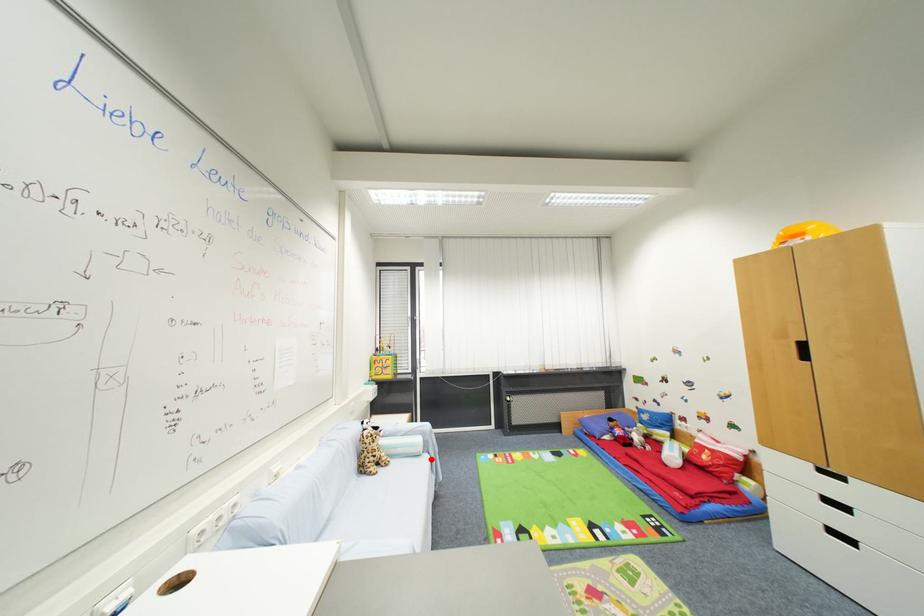
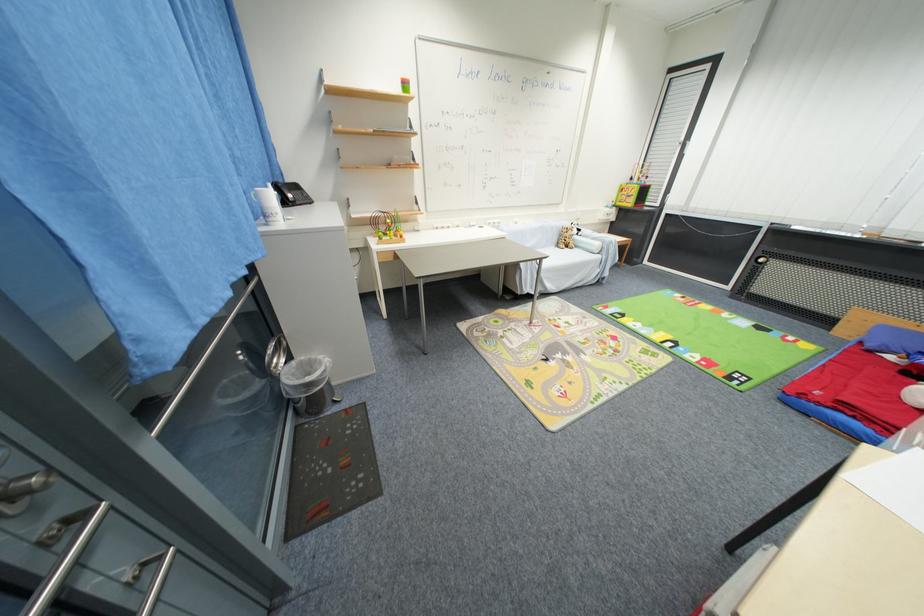
Question: I am providing you with two images of the same scene from different viewpoints. Given a red point in image1, look at the same physical point in image2. Is it:

Choices:
 (A) Closer to the viewpoint
 (B) Farther from the viewpoint

Answer: (A)